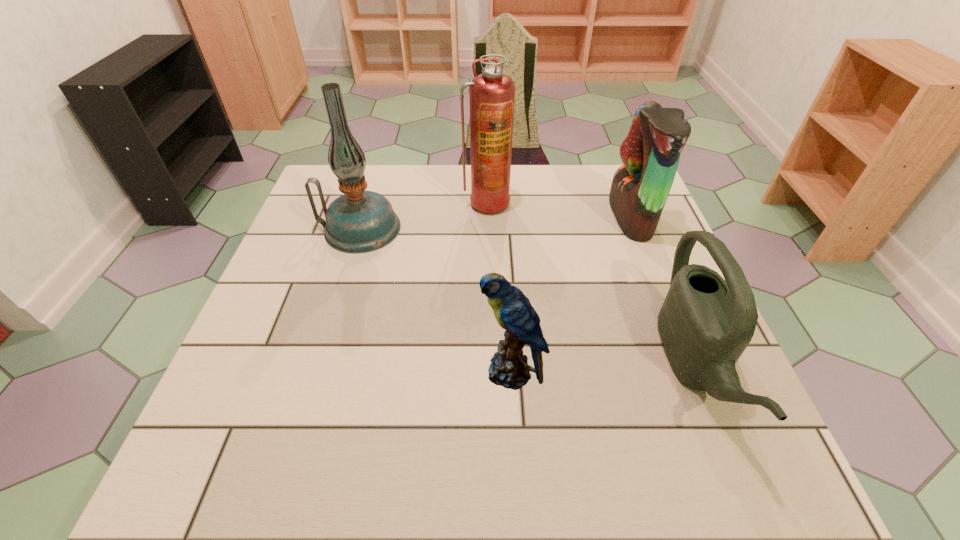
Find the location of a particular element. This screenshot has height=540, width=960. vacant space located at the face of the taller parrot is located at coordinates (552, 217).

Locate an element on the screen. The width and height of the screenshot is (960, 540). vacant position located at the face of the taller parrot is located at coordinates (556, 217).

Image resolution: width=960 pixels, height=540 pixels. In order to click on free location located 0.150m on the face of the left parrot in this screenshot , I will do `click(400, 372)`.

Identify the location of vacant space located 0.100m on the face of the left parrot. (427, 372).

This screenshot has height=540, width=960. In order to click on free region located 0.160m on the face of the left parrot in this screenshot , I will do `click(396, 372)`.

Locate an element on the screen. The height and width of the screenshot is (540, 960). vacant region located 0.380m on the spout of the watering can is located at coordinates (469, 367).

Locate an element on the screen. free space located on the spout of the watering can is located at coordinates (459, 367).

Identify the location of vacant region located on the spout of the watering can. (459, 367).

I want to click on fire extinguisher that is at the far edge, so click(492, 94).

Find the location of `oil lamp situated at the far edge`. oil lamp situated at the far edge is located at coordinates (359, 221).